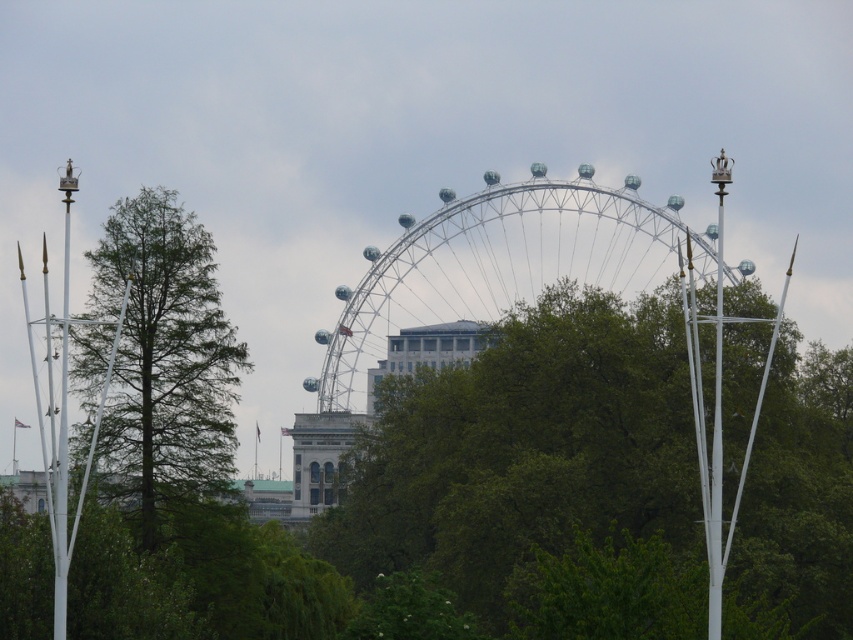
Is green leafy tree at center below green matte tree at left?

Yes.

At what (x,y) coordinates should I click in order to perform the action: click on green leafy tree at center. Please return your answer as a coordinate pair (x, y). The image size is (853, 640). Looking at the image, I should click on (526, 451).

Does metallic silver ferris wheel at center appear over green matte tree at left?

Indeed, metallic silver ferris wheel at center is positioned over green matte tree at left.

Who is positioned more to the right, metallic silver ferris wheel at center or green matte tree at left?

Positioned to the right is metallic silver ferris wheel at center.

Is point (344, 326) more distant than point (223, 410)?

Yes, point (344, 326) is farther from viewer.

Find the location of a particular element. The height and width of the screenshot is (640, 853). metallic silver ferris wheel at center is located at coordinates (486, 275).

Who is taller, green leafy tree at center or metallic silver ferris wheel at center?

green leafy tree at center is taller.

Is green leafy tree at center positioned in front of metallic silver ferris wheel at center?

Yes, it is.

Does point (682, 481) come farther from viewer compared to point (532, 180)?

That is False.

Where is `green leafy tree at center`? green leafy tree at center is located at coordinates (526, 451).